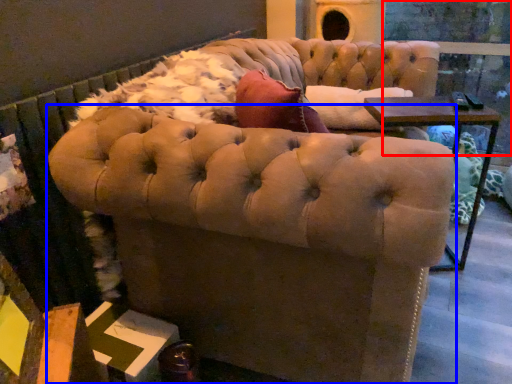
Question: Among these objects, which one is nearest to the camera, glass door (highlighted by a red box) or chair (highlighted by a blue box)?

Choices:
 (A) glass door
 (B) chair

Answer: (B)